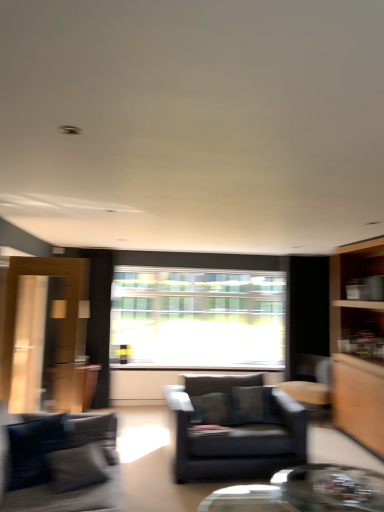
Where is `transparent glass coffee table at lower center`? The image size is (384, 512). transparent glass coffee table at lower center is located at coordinates (305, 492).

At what (x,y) coordinates should I click in order to perform the action: click on matte black armchair at center. Please return your answer as a coordinate pair (x, y). This screenshot has width=384, height=512. Looking at the image, I should click on (x=235, y=426).

Describe the element at coordinates (74, 386) in the screenshot. I see `matte wood cabinet at left` at that location.

Where is `transparent glass coffee table at lower center`? transparent glass coffee table at lower center is located at coordinates (305, 492).

Considering the relative positions of matte black armchair at center and dark blue fabric couch at lower left in the image provided, is matte black armchair at center to the right of dark blue fabric couch at lower left from the viewer's perspective?

Correct, you'll find matte black armchair at center to the right of dark blue fabric couch at lower left.

In the scene shown: From a real-world perspective, is matte black armchair at center on dark blue fabric couch at lower left?

No, from a real-world perspective, matte black armchair at center is not on top of dark blue fabric couch at lower left.

Would you say transparent glass coffee table at lower center is a long distance from matte black armchair at center?

No.

Considering the sizes of transparent glass coffee table at lower center and matte black armchair at center in the image, is transparent glass coffee table at lower center wider or thinner than matte black armchair at center?

Clearly, transparent glass coffee table at lower center has more width compared to matte black armchair at center.

Between transparent glass coffee table at lower center and matte black armchair at center, which one has smaller size?

Smaller between the two is transparent glass coffee table at lower center.

From a real-world perspective, which object stands above the other?

transparent glass window at center is physically above.

How many degrees apart are the facing directions of matte wood cabinet at left and transparent glass window at center?

90.2 degrees.

There is a matte wood cabinet at left. What are the coordinates of `window above it (from a real-world perspective)` in the screenshot? It's located at (199, 310).

Is matte wood cabinet at left not inside transparent glass window at center?

Indeed, matte wood cabinet at left is completely outside transparent glass window at center.

Considering the sizes of objects transparent glass coffee table at lower center and dark blue fabric couch at lower left in the image provided, who is shorter, transparent glass coffee table at lower center or dark blue fabric couch at lower left?

transparent glass coffee table at lower center.

This screenshot has width=384, height=512. I want to click on coffee table located behind the dark blue fabric couch at lower left, so click(x=305, y=492).

Between transparent glass coffee table at lower center and dark blue fabric couch at lower left, which one appears on the right side from the viewer's perspective?

transparent glass coffee table at lower center.

In the scene shown: Which object is wider, transparent glass coffee table at lower center or transparent glass window at center?

transparent glass coffee table at lower center is wider.

Is point (350, 498) positioned in front of point (246, 294)?

Yes, point (350, 498) is in front of point (246, 294).

From a real-world perspective, is transparent glass coffee table at lower center positioned under transparent glass window at center based on gravity?

Yes, from a real-world perspective, transparent glass coffee table at lower center is under transparent glass window at center.

The width and height of the screenshot is (384, 512). I want to click on window located behind the transparent glass coffee table at lower center, so click(x=199, y=310).

Could you tell me if matte wood cabinet at left is turned towards matte black armchair at center?

No, matte wood cabinet at left is not facing towards matte black armchair at center.

Which object is thinner, matte wood cabinet at left or matte black armchair at center?

matte wood cabinet at left is thinner.

In the scene shown: What's the angular difference between matte wood cabinet at left and matte black armchair at center's facing directions?

matte wood cabinet at left and matte black armchair at center are facing 88.9 degrees away from each other.

At what (x,y) coordinates should I click in order to perform the action: click on chair on the right of matte wood cabinet at left. Please return your answer as a coordinate pair (x, y). This screenshot has height=512, width=384. Looking at the image, I should click on (235, 426).

Between dark blue fabric couch at lower left and matte wood cabinet at left, which one has less height?

matte wood cabinet at left.

Between dark blue fabric couch at lower left and matte wood cabinet at left, which one is positioned in front?

Positioned in front is dark blue fabric couch at lower left.

From a real-world perspective, which object stands above the other?

dark blue fabric couch at lower left is physically above.

From the image's perspective, who appears lower, dark blue fabric couch at lower left or matte wood cabinet at left?

From the image's view, matte wood cabinet at left is below.

The height and width of the screenshot is (512, 384). Identify the location of chair below the dark blue fabric couch at lower left (from the image's perspective). (235, 426).

Identify the location of chair located behind the transparent glass coffee table at lower center. Image resolution: width=384 pixels, height=512 pixels. (235, 426).

Estimate the real-world distances between objects in this image. Which object is further from matte black armchair at center, transparent glass coffee table at lower center or matte wood cabinet at left?

matte wood cabinet at left.

When comparing their distances from matte wood cabinet at left, does transparent glass coffee table at lower center or matte black armchair at center seem closer?

matte black armchair at center is closer to matte wood cabinet at left.

Considering their positions, is dark blue fabric couch at lower left positioned further to matte black armchair at center than transparent glass coffee table at lower center?

The object further to matte black armchair at center is dark blue fabric couch at lower left.

Which object lies further to the anchor point matte wood cabinet at left, transparent glass window at center or transparent glass coffee table at lower center?

Among the two, transparent glass coffee table at lower center is located further to matte wood cabinet at left.

From the picture: Based on their spatial positions, is matte wood cabinet at left or dark blue fabric couch at lower left closer to transparent glass window at center?

matte wood cabinet at left lies closer to transparent glass window at center than the other object.

From the image, which object appears to be farther from transparent glass coffee table at lower center, transparent glass window at center or matte black armchair at center?

transparent glass window at center lies further to transparent glass coffee table at lower center than the other object.

Considering their positions, is dark blue fabric couch at lower left positioned further to transparent glass coffee table at lower center than matte wood cabinet at left?

matte wood cabinet at left lies further to transparent glass coffee table at lower center than the other object.

From the image, which object appears to be farther from transparent glass window at center, matte black armchair at center or transparent glass coffee table at lower center?

transparent glass coffee table at lower center is further to transparent glass window at center.

At what (x,y) coordinates should I click in order to perform the action: click on cabinetry between matte black armchair at center and transparent glass window at center in the front-back direction. Please return your answer as a coordinate pair (x, y). Looking at the image, I should click on (74, 386).

You are a GUI agent. You are given a task and a screenshot of the screen. Output one action in this format:
    pyautogui.click(x=<x>, y=<y>)
    Task: Click on the coffee table between dark blue fabric couch at lower left and matte wood cabinet at left in the front-back direction
    This screenshot has height=512, width=384.
    Given the screenshot: What is the action you would take?
    pyautogui.click(x=305, y=492)

Locate an element on the screen. This screenshot has width=384, height=512. chair positioned between dark blue fabric couch at lower left and matte wood cabinet at left from near to far is located at coordinates (235, 426).

This screenshot has width=384, height=512. I want to click on coffee table between dark blue fabric couch at lower left and transparent glass window at center along the z-axis, so click(305, 492).